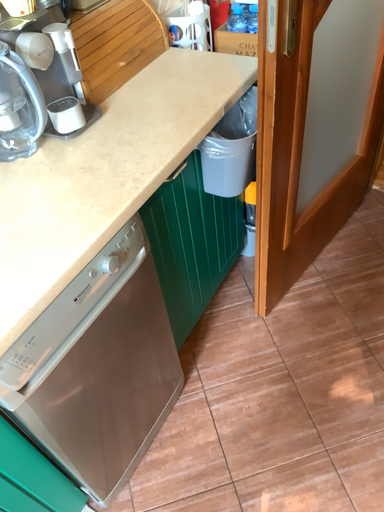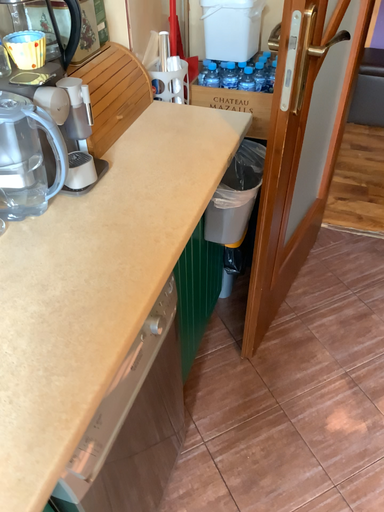
Question: Which way did the camera rotate in the video?

Choices:
 (A) rotated left
 (B) rotated right

Answer: (B)